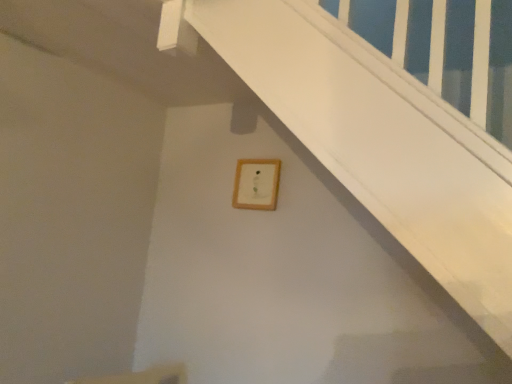
This screenshot has height=384, width=512. What do you see at coordinates (256, 184) in the screenshot?
I see `wooden frame at upper center` at bounding box center [256, 184].

The image size is (512, 384). I want to click on wooden frame at upper center, so click(x=256, y=184).

In order to face wooden frame at upper center, should I rotate leftwards or rightwards?

To align with it, rotate left about 0.127°.

Measure the distance between wooden frame at upper center and camera.

wooden frame at upper center is 2.04 meters away from camera.

Identify the location of wooden frame at upper center. (256, 184).